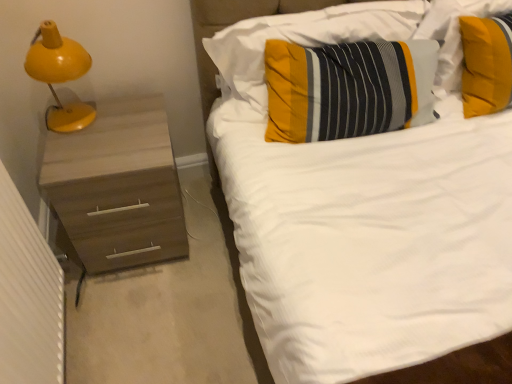
The height and width of the screenshot is (384, 512). Find the location of `free space below yellow matte lamp at left (from a real-world perspective)`. free space below yellow matte lamp at left (from a real-world perspective) is located at coordinates (71, 117).